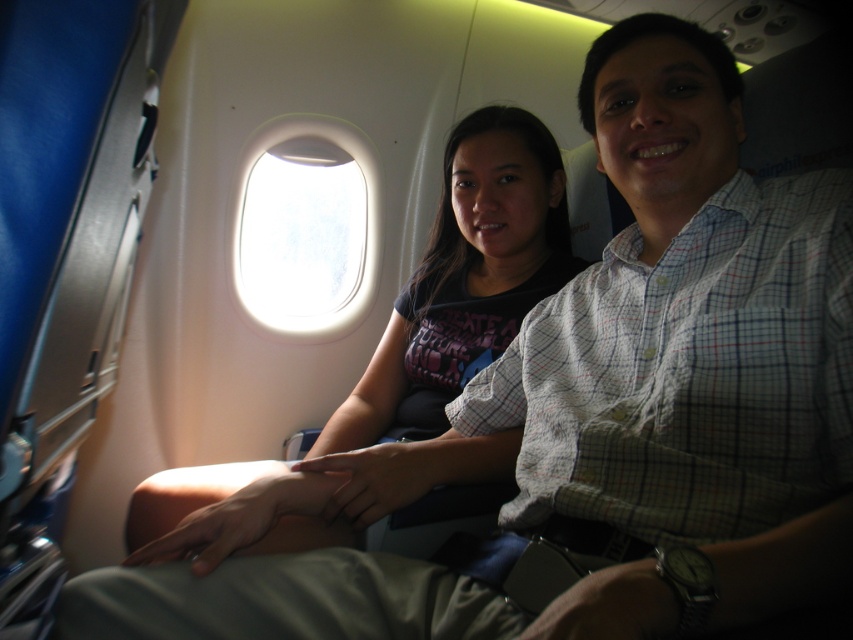
Question: Which point is closer to the camera taking this photo?

Choices:
 (A) (297, 176)
 (B) (440, 273)

Answer: (B)

Question: Can you confirm if matte black shirt at center is smaller than transparent glass airplane window at center?

Choices:
 (A) no
 (B) yes

Answer: (B)

Question: Can you confirm if matte black shirt at center is thinner than transparent glass airplane window at center?

Choices:
 (A) yes
 (B) no

Answer: (A)

Question: Which point appears closest to the camera in this image?

Choices:
 (A) (x=323, y=218)
 (B) (x=471, y=269)

Answer: (B)

Question: Does matte black shirt at center have a greater width compared to transparent glass airplane window at center?

Choices:
 (A) yes
 (B) no

Answer: (B)